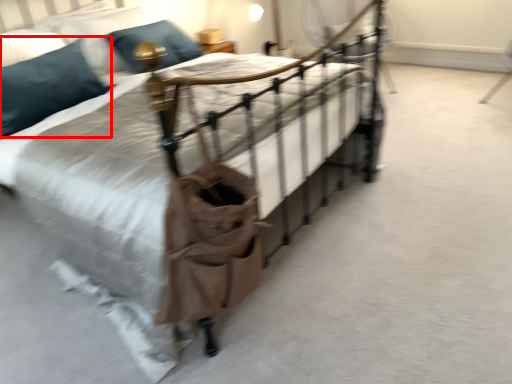
Question: In this image, where is pillow (annotated by the red box) located relative to pillow?

Choices:
 (A) left
 (B) right

Answer: (A)